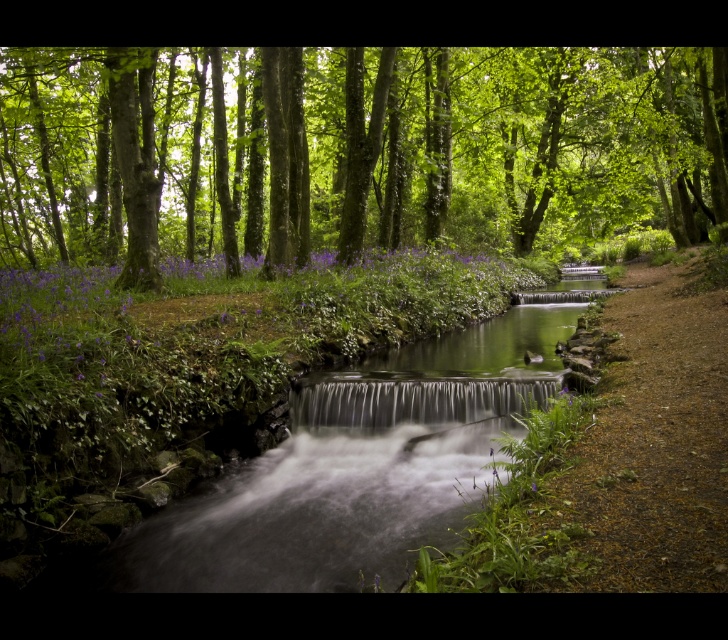
Is point (724, 236) closer to camera compared to point (341, 380)?

That is False.

Is green leafy tree at center smaller than clear glass waterfall at center?

No, green leafy tree at center is not smaller than clear glass waterfall at center.

Who is more forward, (82, 99) or (467, 378)?

Point (467, 378)

Locate an element on the screen. green leafy tree at center is located at coordinates (355, 150).